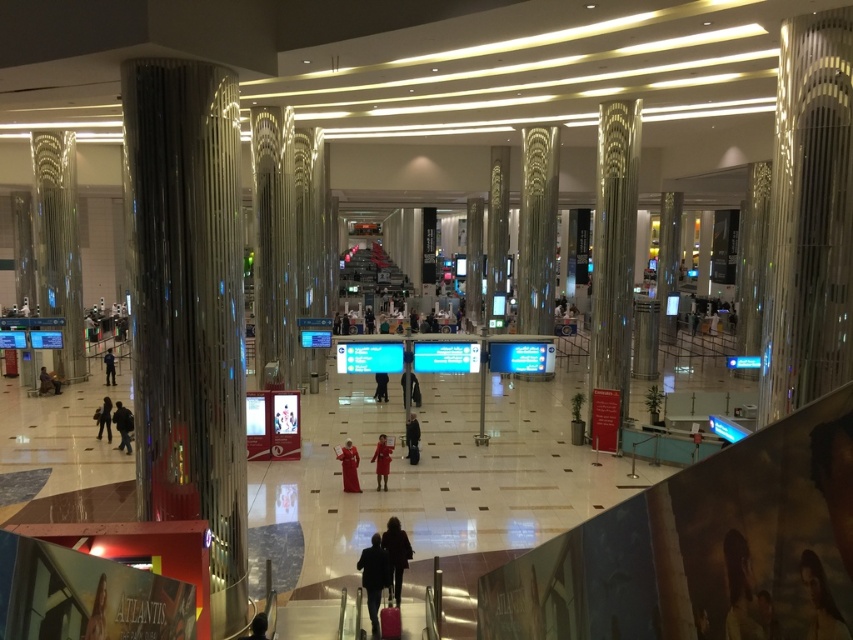
Question: Which point is closer to the camera taking this photo?

Choices:
 (A) (370, 620)
 (B) (820, 563)
 (C) (380, 381)
 (D) (351, 472)

Answer: (B)

Question: In this image, where is velvet red dress at center located relative to black fabric dress at center?

Choices:
 (A) below
 (B) above

Answer: (A)

Question: Does metallic silver pillar at center lie in front of smooth skin portrait at lower right?

Choices:
 (A) yes
 (B) no

Answer: (B)

Question: Which of the following is the closest to the observer?

Choices:
 (A) matte black person at lower left
 (B) metallic silver pillar at center

Answer: (B)

Question: Which point appears farthest from the camera in this image?

Choices:
 (A) (164, 420)
 (B) (347, 483)

Answer: (B)

Question: Does dark gray fabric jacket at left have a smaller size compared to dark gray suit at center?

Choices:
 (A) no
 (B) yes

Answer: (A)